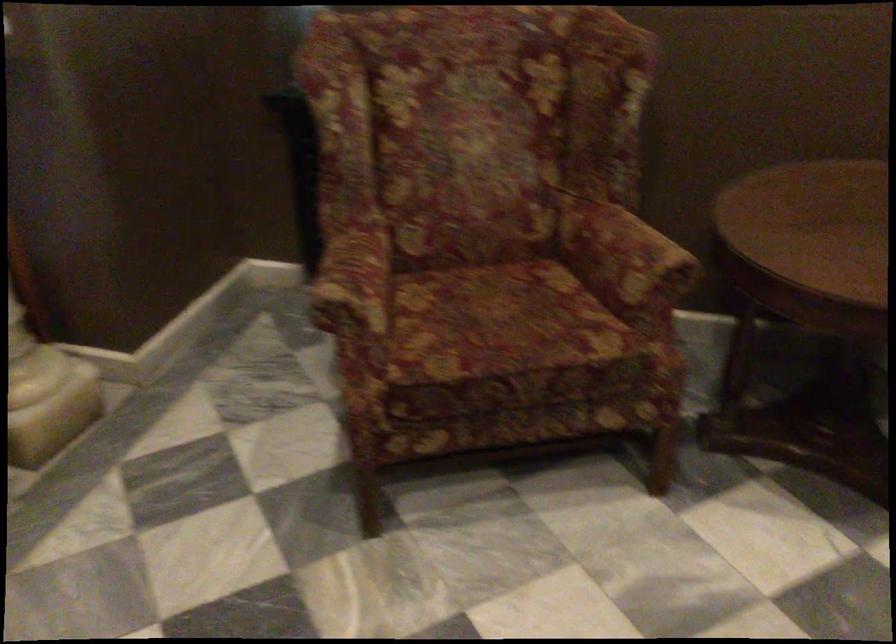
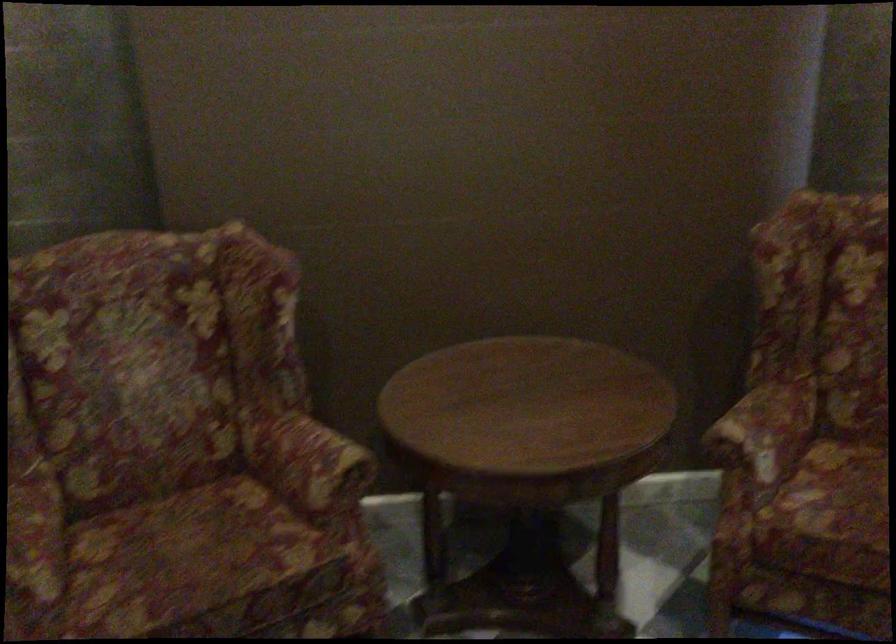
What movement of the cameraman would produce the second image?

The movement direction of the cameraman is right, backward.